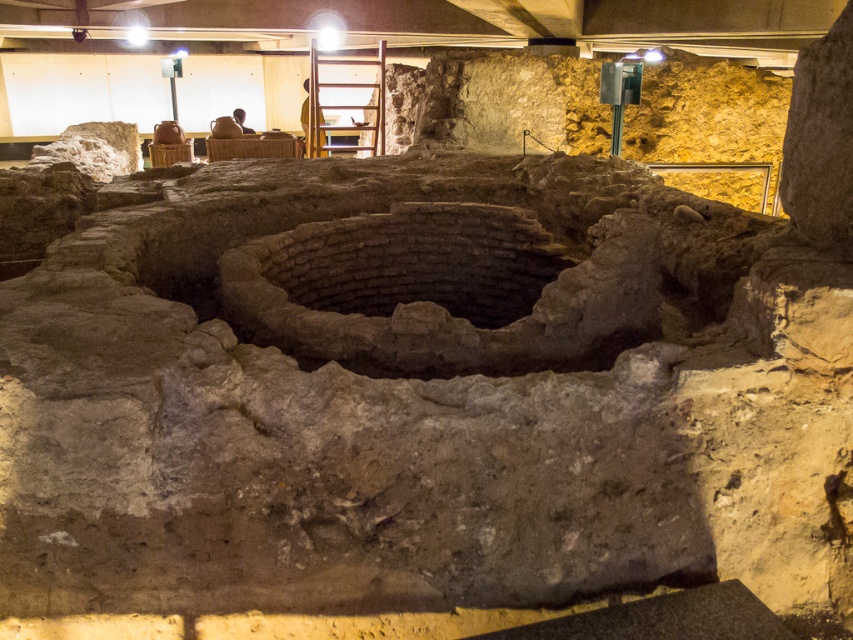
Question: Which object is closer to the camera taking this photo?

Choices:
 (A) matte brown vase at upper center
 (B) brown textured stone well at center

Answer: (B)

Question: Which point appears closest to the camera in this image?

Choices:
 (A) (312, 104)
 (B) (300, 116)
 (C) (229, 120)
 (D) (375, 310)

Answer: (D)

Question: Based on their relative distances, which object is nearer to the wooden ladder at upper center?

Choices:
 (A) brown leather chair at center
 (B) brown textured stone well at center
 (C) matte brown vase at upper center

Answer: (A)

Question: Does wooden ladder at upper center have a larger size compared to brown leather chair at center?

Choices:
 (A) no
 (B) yes

Answer: (B)

Question: Where is brown textured stone well at center located in relation to brown leather chair at center in the image?

Choices:
 (A) left
 (B) right

Answer: (B)

Question: Is brown textured stone well at center above wooden ladder at upper center?

Choices:
 (A) yes
 (B) no

Answer: (B)